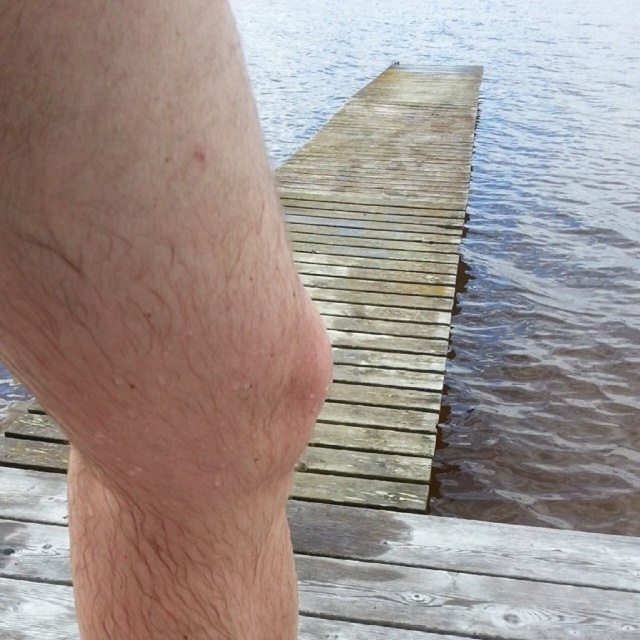
Question: Does hairless skin at center appear on the left side of brown wooden dock at center?

Choices:
 (A) no
 (B) yes

Answer: (B)

Question: Which point is farther to the camera?

Choices:
 (A) (129, 218)
 (B) (552, 125)

Answer: (B)

Question: Can you confirm if hairless skin at center is bigger than brown wooden dock at center?

Choices:
 (A) yes
 (B) no

Answer: (B)

Question: Which point appears closest to the camera in this image?

Choices:
 (A) (563, 180)
 (B) (186, 564)

Answer: (B)

Question: Does hairless skin at center appear on the right side of brown wooden dock at center?

Choices:
 (A) yes
 (B) no

Answer: (B)

Question: Among these objects, which one is farthest from the camera?

Choices:
 (A) brown wooden dock at center
 (B) hairless skin at center

Answer: (A)